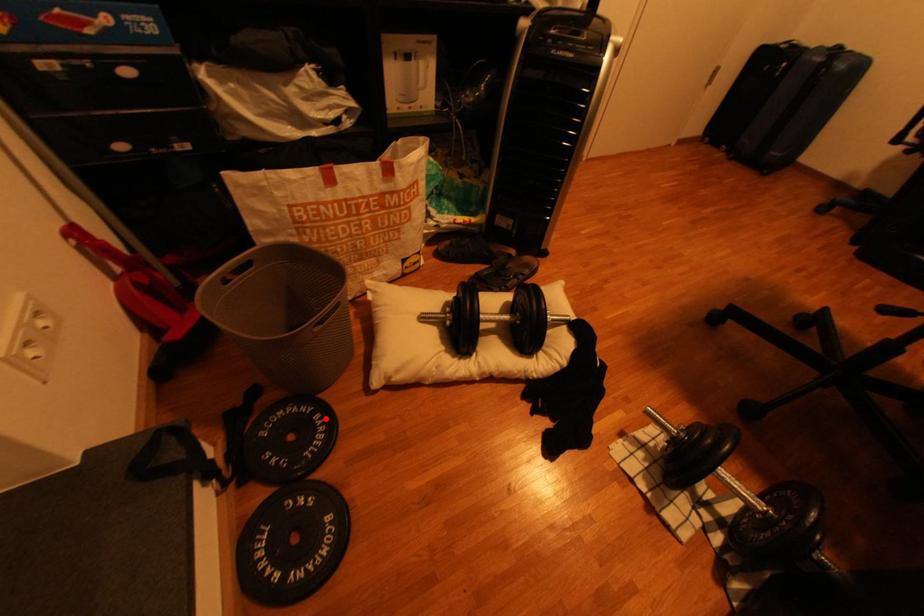
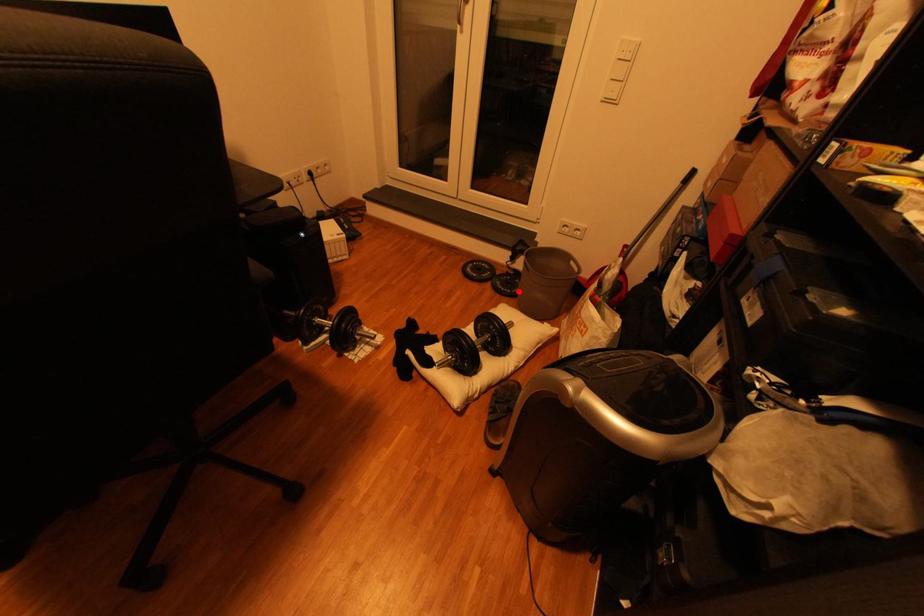
I am providing you with two images of the same scene from different viewpoints. A red point is marked on the first image and another point is marked on the second image. Does the point marked in image1 correspond to the same location as the one in image2?

Yes